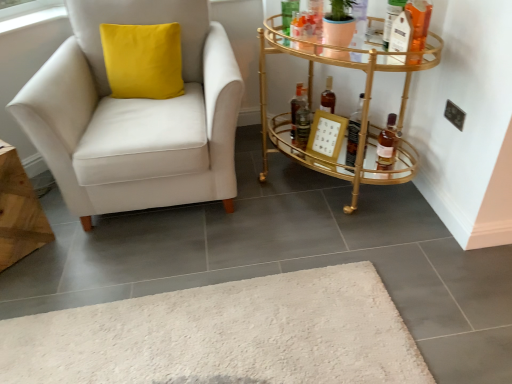
Question: Considering the relative sizes of white fabric chair at left and shiny dark brown bottle at center, acting as the 3th bottle starting from the right, in the image provided, is white fabric chair at left wider than shiny dark brown bottle at center, acting as the 3th bottle starting from the right,?

Choices:
 (A) yes
 (B) no

Answer: (A)

Question: Is white fabric chair at left bigger than shiny dark brown bottle at center, acting as the 3th bottle starting from the right?

Choices:
 (A) no
 (B) yes

Answer: (B)

Question: Is white fabric chair at left far away from shiny dark brown bottle at center, acting as the 3th bottle starting from the right?

Choices:
 (A) no
 (B) yes

Answer: (A)

Question: Is white fabric chair at left not inside shiny dark brown bottle at center, the 1th bottle positioned from the left?

Choices:
 (A) no
 (B) yes

Answer: (B)

Question: Can you confirm if white fabric chair at left is shorter than shiny dark brown bottle at center, the 1th bottle positioned from the left?

Choices:
 (A) yes
 (B) no

Answer: (B)

Question: Does white fabric chair at left appear on the left side of shiny dark brown bottle at center, the 1th bottle positioned from the left?

Choices:
 (A) no
 (B) yes

Answer: (B)

Question: From the image's perspective, does shiny dark brown bottle at center, the 1th bottle positioned from the left, appear lower than white fabric chair at left?

Choices:
 (A) yes
 (B) no

Answer: (A)

Question: Can white fabric chair at left be found inside shiny dark brown bottle at center, the 1th bottle positioned from the left?

Choices:
 (A) yes
 (B) no

Answer: (B)

Question: Is shiny dark brown bottle at center, the 1th bottle positioned from the left, shorter than white fabric chair at left?

Choices:
 (A) no
 (B) yes

Answer: (B)

Question: Considering the relative sizes of shiny dark brown bottle at center, acting as the 3th bottle starting from the right, and white fabric chair at left in the image provided, is shiny dark brown bottle at center, acting as the 3th bottle starting from the right, thinner than white fabric chair at left?

Choices:
 (A) yes
 (B) no

Answer: (A)

Question: Considering the relative positions of shiny dark brown bottle at center, acting as the 3th bottle starting from the right, and white fabric chair at left in the image provided, is shiny dark brown bottle at center, acting as the 3th bottle starting from the right, to the left of white fabric chair at left from the viewer's perspective?

Choices:
 (A) yes
 (B) no

Answer: (B)

Question: Can you confirm if shiny dark brown bottle at center, acting as the 3th bottle starting from the right, is wider than white fabric chair at left?

Choices:
 (A) yes
 (B) no

Answer: (B)

Question: Would you say gold metallic bar cart at right contains gold metallic picture frame at center right?

Choices:
 (A) no
 (B) yes

Answer: (B)